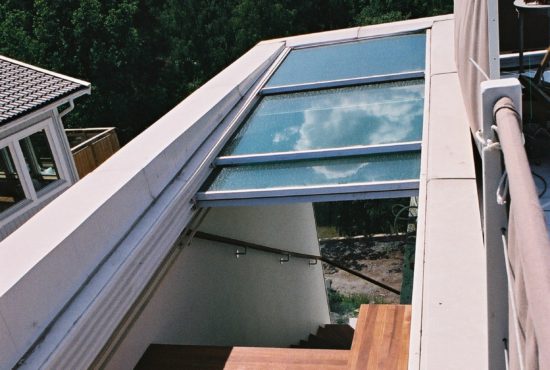
The height and width of the screenshot is (370, 550). I want to click on window, so click(293, 181).